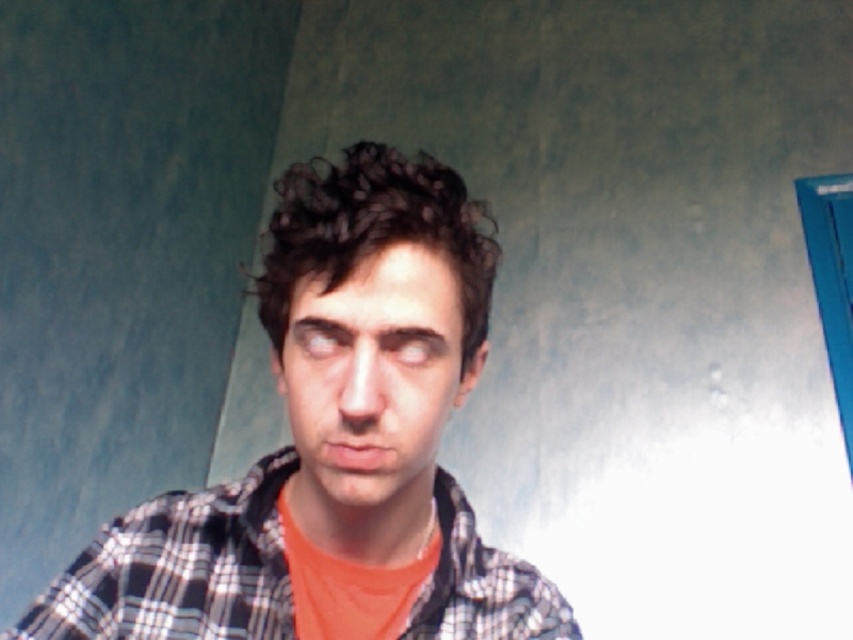
Question: In this image, where is plaid shirt at center located relative to plaid cotton shirt at center?

Choices:
 (A) right
 (B) left

Answer: (A)

Question: Is plaid shirt at center thinner than plaid cotton shirt at center?

Choices:
 (A) yes
 (B) no

Answer: (B)

Question: Among these points, which one is farthest from the camera?

Choices:
 (A) (177, 561)
 (B) (447, 332)

Answer: (A)

Question: Where is plaid shirt at center located in relation to plaid cotton shirt at center in the image?

Choices:
 (A) above
 (B) below

Answer: (A)

Question: Which of the following is the closest to the observer?

Choices:
 (A) plaid shirt at center
 (B) plaid cotton shirt at center

Answer: (A)